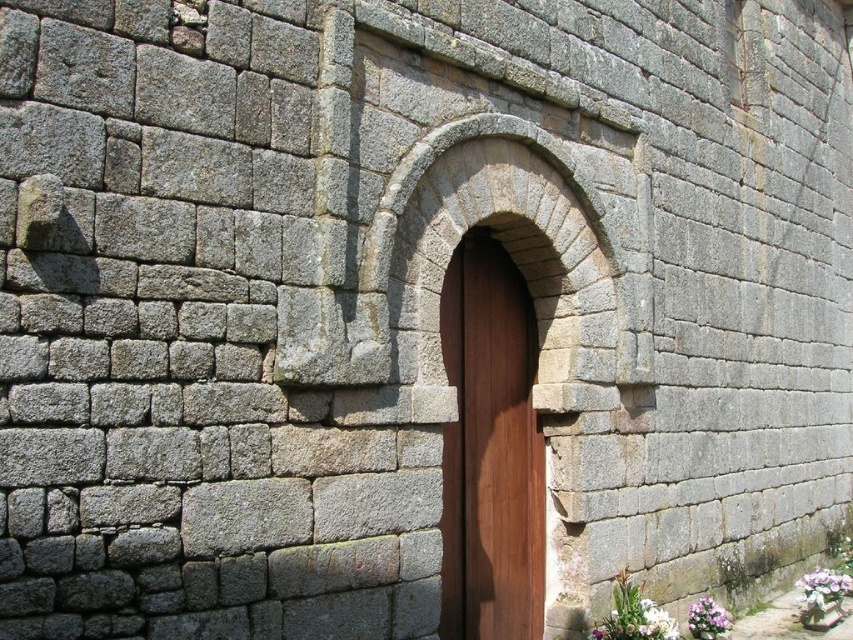
You are standing in front of the stone wall with the arched doorway. There is a point marked at coordinates (822, 588). Based on the image, what object is this point located on?

The point at coordinates (822, 588) is located on the purple floral bouquet at lower right.

You are standing in front of the stone wall with the arched doorway. You notice two points marked on the wall at coordinates point (515, 429) and point (669, 627). Which point is closer to you?

Point (515, 429) is closer to you because it is further to the viewer than point (669, 627).